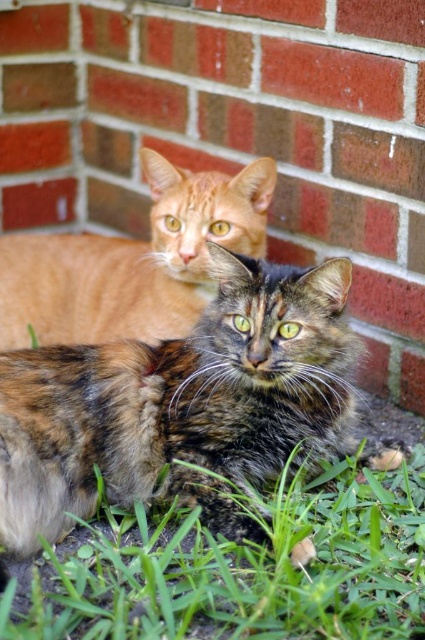
Question: Which object is the farthest from the green grass at lower center?

Choices:
 (A) orange fur cat at upper center
 (B) calico fur cat at center

Answer: (A)

Question: Which point is farther to the camera?

Choices:
 (A) (340, 627)
 (B) (251, 186)
 (C) (212, 435)

Answer: (B)

Question: Does calico fur cat at center have a smaller size compared to green grass at lower center?

Choices:
 (A) yes
 (B) no

Answer: (B)

Question: Is green grass at lower center above orange fur cat at upper center?

Choices:
 (A) no
 (B) yes

Answer: (A)

Question: In this image, where is calico fur cat at center located relative to orange fur cat at upper center?

Choices:
 (A) below
 (B) above

Answer: (A)

Question: Which point is farther to the camera?

Choices:
 (A) (14, 598)
 (B) (87, 250)
 (C) (243, 346)

Answer: (B)